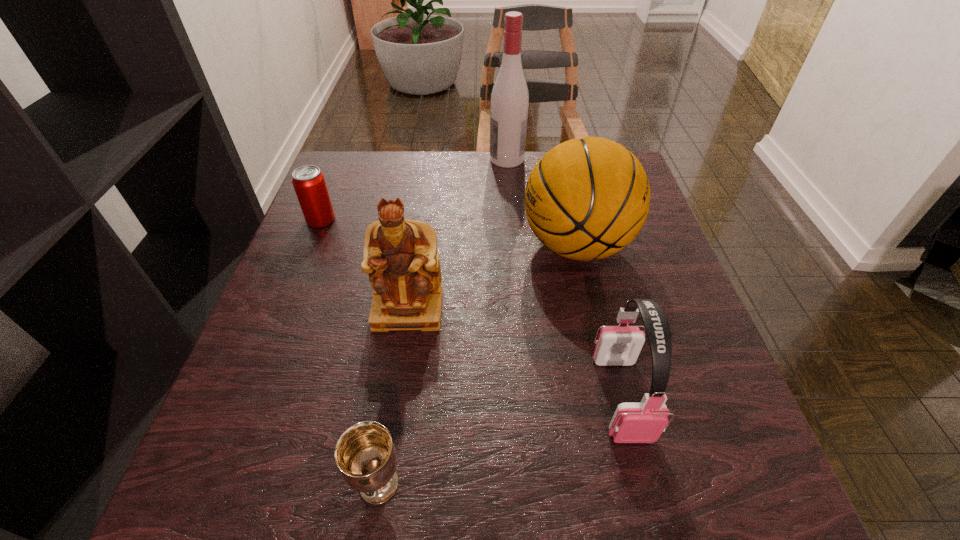
You are a GUI agent. You are given a task and a screenshot of the screen. Output one action in this format:
    pyautogui.click(x=<x>, y=<y>)
    Task: Click on the alcohol
    This screenshot has height=540, width=960.
    Given the screenshot: What is the action you would take?
    pyautogui.click(x=509, y=103)

You are a GUI agent. You are given a task and a screenshot of the screen. Output one action in this format:
    pyautogui.click(x=<x>, y=<y>)
    Task: Click on the farthest object
    The image size is (960, 540).
    Given the screenshot: What is the action you would take?
    pyautogui.click(x=509, y=103)

Identify the location of basketball. (587, 198).

The width and height of the screenshot is (960, 540). I want to click on the third nearest object, so click(x=400, y=256).

Identify the location of the fourth tallest object. This screenshot has width=960, height=540. (644, 422).

Where is `the second nearest object`? the second nearest object is located at coordinates (644, 422).

The width and height of the screenshot is (960, 540). I want to click on can, so click(x=309, y=183).

You are a GUI agent. You are given a task and a screenshot of the screen. Output one action in this format:
    pyautogui.click(x=<x>, y=<y>)
    Task: Click on the chalice
    Image resolution: width=960 pixels, height=540 pixels.
    Given the screenshot: What is the action you would take?
    pyautogui.click(x=364, y=453)

At what (x,y) coordinates should I click in order to perform the action: click on vacant space located on the label of the farthest object. Please return your answer as a coordinate pair (x, y). Looking at the image, I should click on (465, 159).

Locate an element on the screen. This screenshot has width=960, height=540. free space located 0.110m on the label of the farthest object is located at coordinates (451, 159).